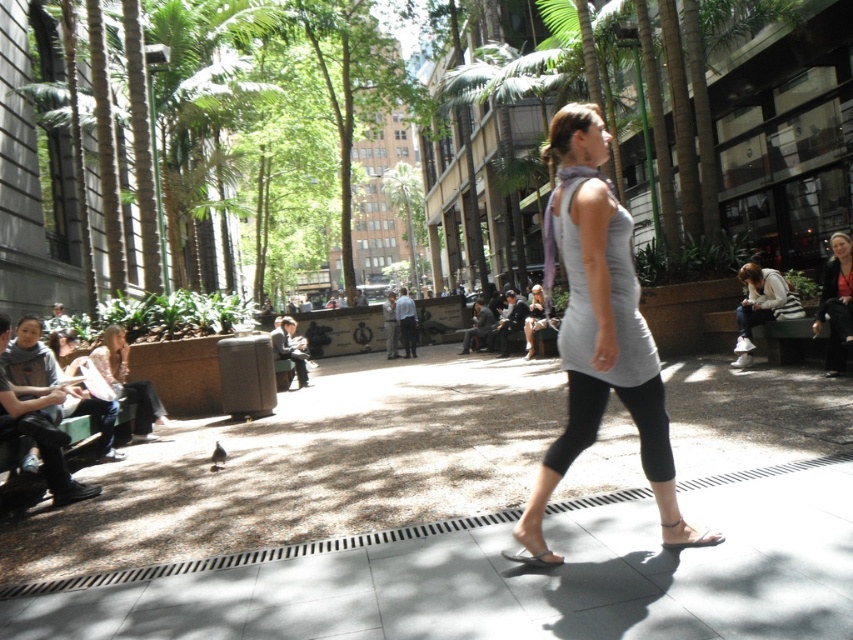
The image size is (853, 640). What do you see at coordinates (502, 576) in the screenshot? I see `smooth concrete pavement at center` at bounding box center [502, 576].

Can you confirm if smooth concrete pavement at center is positioned to the left of white fabric jacket at right?

Indeed, smooth concrete pavement at center is positioned on the left side of white fabric jacket at right.

Describe the element at coordinates (502, 576) in the screenshot. I see `smooth concrete pavement at center` at that location.

Where is `smooth concrete pavement at center`? The width and height of the screenshot is (853, 640). smooth concrete pavement at center is located at coordinates (502, 576).

Does light gray fabric dress at center lie behind dark gray fabric jacket at center?

No, light gray fabric dress at center is closer to the viewer.

Who is higher up, light gray fabric dress at center or dark gray fabric jacket at center?

Positioned higher is light gray fabric dress at center.

This screenshot has height=640, width=853. What do you see at coordinates (598, 324) in the screenshot? I see `light gray fabric dress at center` at bounding box center [598, 324].

Where is `light gray fabric dress at center`? The width and height of the screenshot is (853, 640). light gray fabric dress at center is located at coordinates (598, 324).

Which is above, green wooden bench at lower left or black leather sandal at center?

green wooden bench at lower left

Does green wooden bench at lower left have a lesser width compared to black leather sandal at center?

Yes, green wooden bench at lower left is thinner than black leather sandal at center.

Measure the distance between point (x=77, y=428) and camera.

Point (x=77, y=428) and camera are 5.52 meters apart from each other.

Where is `green wooden bench at lower left`? Image resolution: width=853 pixels, height=640 pixels. green wooden bench at lower left is located at coordinates (13, 458).